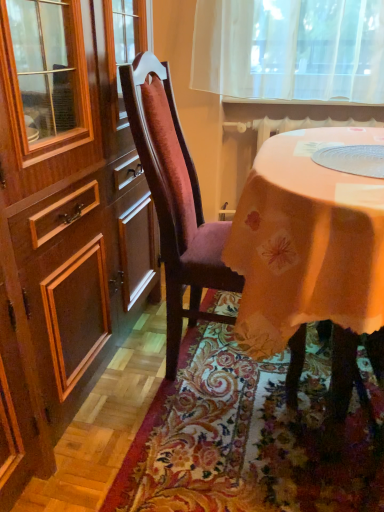
Question: Based on their positions, is floral carpet at lower center located to the left or right of velvet burgundy chair at center?

Choices:
 (A) left
 (B) right

Answer: (B)

Question: Based on their sizes in the image, would you say floral carpet at lower center is bigger or smaller than velvet burgundy chair at center?

Choices:
 (A) small
 (B) big

Answer: (A)

Question: From a real-world perspective, is floral carpet at lower center positioned above or below velvet burgundy chair at center?

Choices:
 (A) above
 (B) below

Answer: (B)

Question: In the image, is velvet burgundy chair at center on the left side or the right side of floral carpet at lower center?

Choices:
 (A) left
 (B) right

Answer: (A)

Question: Is velvet burgundy chair at center inside the boundaries of floral carpet at lower center, or outside?

Choices:
 (A) inside
 (B) outside

Answer: (B)

Question: In the image, is velvet burgundy chair at center positioned in front of or behind floral carpet at lower center?

Choices:
 (A) front
 (B) behind

Answer: (B)

Question: In terms of height, does velvet burgundy chair at center look taller or shorter compared to floral carpet at lower center?

Choices:
 (A) short
 (B) tall

Answer: (B)